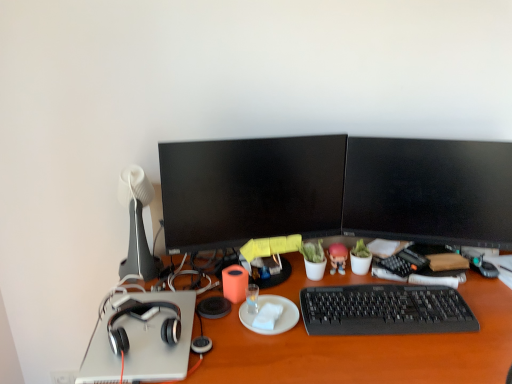
Question: From the image's perspective, is orange matte cup at center over black glossy monitor at center, which is counted as the 1th television, starting from the left?

Choices:
 (A) yes
 (B) no

Answer: (B)

Question: Is orange matte cup at center in contact with black glossy monitor at center, which is counted as the 1th television, starting from the left?

Choices:
 (A) yes
 (B) no

Answer: (B)

Question: Is orange matte cup at center looking in the opposite direction of black glossy monitor at center, the second television when ordered from right to left?

Choices:
 (A) yes
 (B) no

Answer: (B)

Question: Is orange matte cup at center positioned in front of black glossy monitor at center, which is counted as the 1th television, starting from the left?

Choices:
 (A) no
 (B) yes

Answer: (A)

Question: Are orange matte cup at center and black glossy monitor at center, which is counted as the 1th television, starting from the left, far apart?

Choices:
 (A) yes
 (B) no

Answer: (B)

Question: Considering the positions of orange matte cup at center and white matte lamp at left in the image, is orange matte cup at center bigger or smaller than white matte lamp at left?

Choices:
 (A) small
 (B) big

Answer: (A)

Question: Do you think orange matte cup at center is within white matte lamp at left, or outside of it?

Choices:
 (A) outside
 (B) inside

Answer: (A)

Question: From a real-world perspective, is orange matte cup at center above or below white matte lamp at left?

Choices:
 (A) above
 (B) below

Answer: (B)

Question: Is orange matte cup at center wider or thinner than white matte lamp at left?

Choices:
 (A) thin
 (B) wide

Answer: (A)

Question: Based on their sizes in the image, would you say black matte headphones at left is bigger or smaller than white matte plate at center?

Choices:
 (A) small
 (B) big

Answer: (B)

Question: From their relative heights in the image, would you say black matte headphones at left is taller or shorter than white matte plate at center?

Choices:
 (A) tall
 (B) short

Answer: (A)

Question: From a real-world perspective, is black matte headphones at left above or below white matte plate at center?

Choices:
 (A) below
 (B) above

Answer: (A)

Question: Would you say black matte headphones at left is inside or outside white matte plate at center?

Choices:
 (A) outside
 (B) inside

Answer: (A)

Question: Based on their positions, is white matte plate at center located to the left or right of black matte headphones at left?

Choices:
 (A) right
 (B) left

Answer: (A)

Question: From a real-world perspective, relative to black matte headphones at left, is white matte plate at center vertically above or below?

Choices:
 (A) above
 (B) below

Answer: (B)